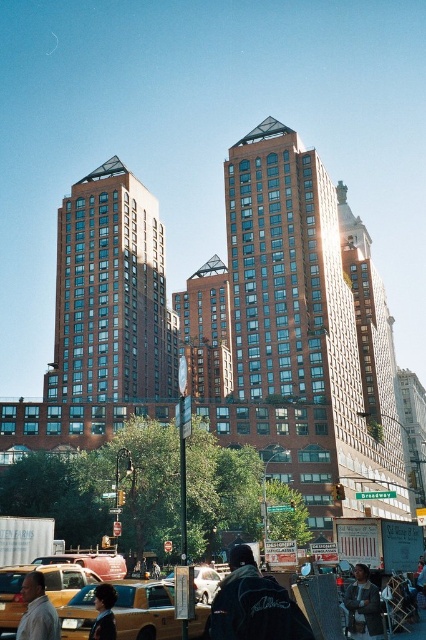
Question: Which point is closer to the camera?

Choices:
 (A) (356, 621)
 (B) (265, 605)

Answer: (B)

Question: Which of the following is the farthest from the observer?

Choices:
 (A) yellow rubber taxi at lower center
 (B) black leather jacket at lower center

Answer: (A)

Question: Does black leather jacket at lower center come in front of denim jacket at lower right?

Choices:
 (A) yes
 (B) no

Answer: (A)

Question: Can you confirm if light beige shirt at lower left is thinner than shiny black hair at center?

Choices:
 (A) no
 (B) yes

Answer: (A)

Question: Is light beige shirt at lower left thinner than shiny black hair at center?

Choices:
 (A) yes
 (B) no

Answer: (B)

Question: Which object is positioned closest to the shiny black hair at center?

Choices:
 (A) denim jacket at lower right
 (B) black leather jacket at lower center

Answer: (B)